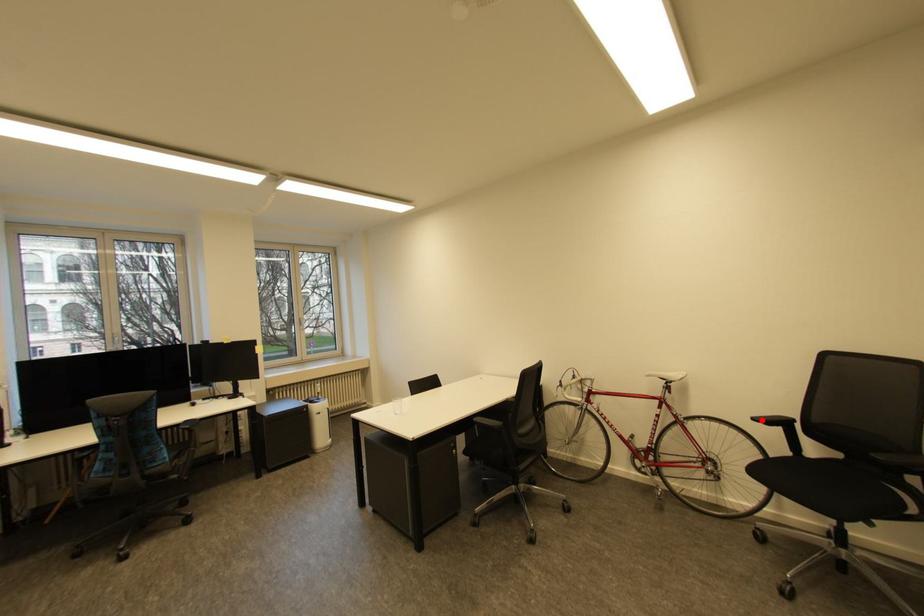
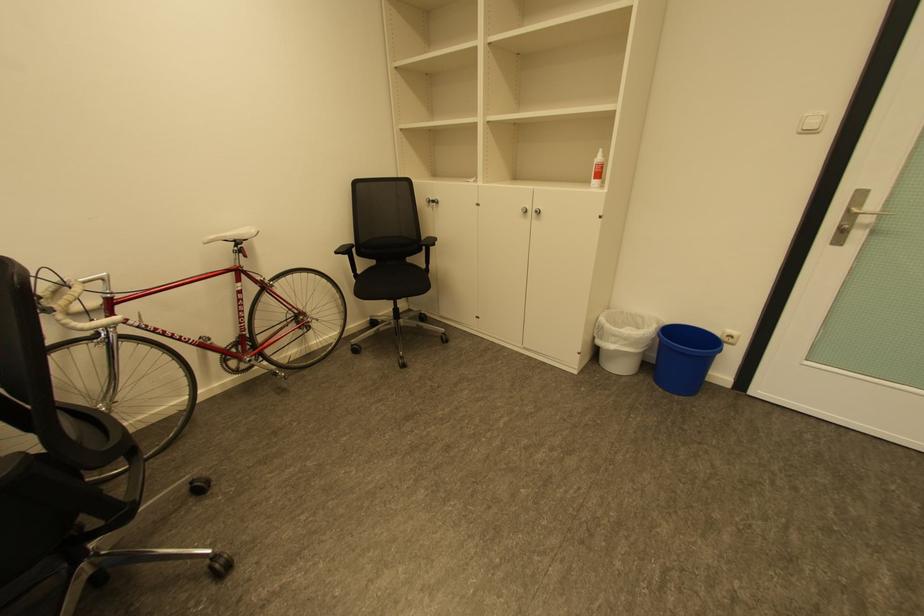
Where in the second image is the point corresponding to the highlighted location from the first image?

(344, 253)